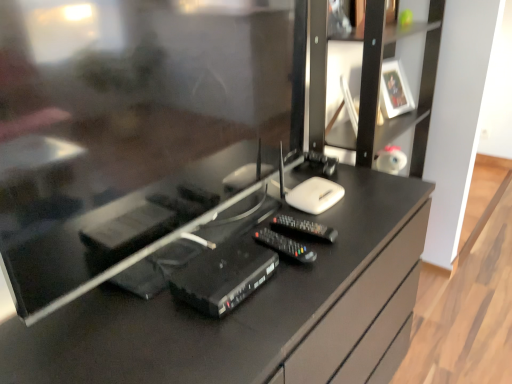
Locate an element on the screen. The width and height of the screenshot is (512, 384). vacant area in front of black plastic router at center, placed as the 2th equipment when sorted from right to left is located at coordinates (216, 340).